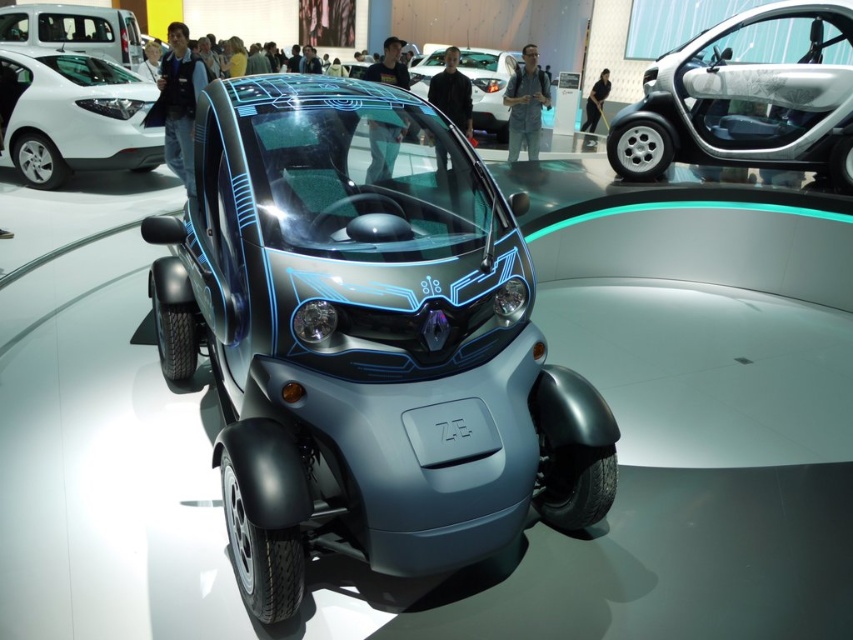
Question: Which object appears closest to the camera in this image?

Choices:
 (A) metallic silver car at center
 (B) white glossy hatchback at upper left

Answer: (A)

Question: Which object is closer to the camera taking this photo?

Choices:
 (A) glossy metallic concept car at center
 (B) white glossy hatchback at upper left

Answer: (A)

Question: Does glossy metallic concept car at center appear under white glossy hatchback at upper left?

Choices:
 (A) no
 (B) yes

Answer: (B)

Question: Which point is farther from the camera taking this photo?

Choices:
 (A) (799, 20)
 (B) (41, 36)
 (C) (109, 145)

Answer: (A)

Question: Is glossy metallic concept car at center thinner than metallic silver car at center?

Choices:
 (A) no
 (B) yes

Answer: (A)

Question: Can you confirm if glossy metallic concept car at center is positioned to the left of matte white van at upper left?

Choices:
 (A) yes
 (B) no

Answer: (B)